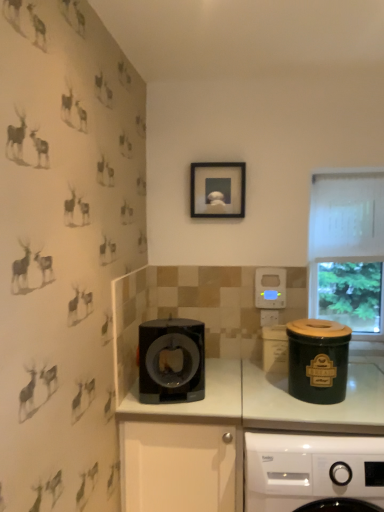
Identify the location of free spot to the right of black glossy coffee maker at center. (219, 396).